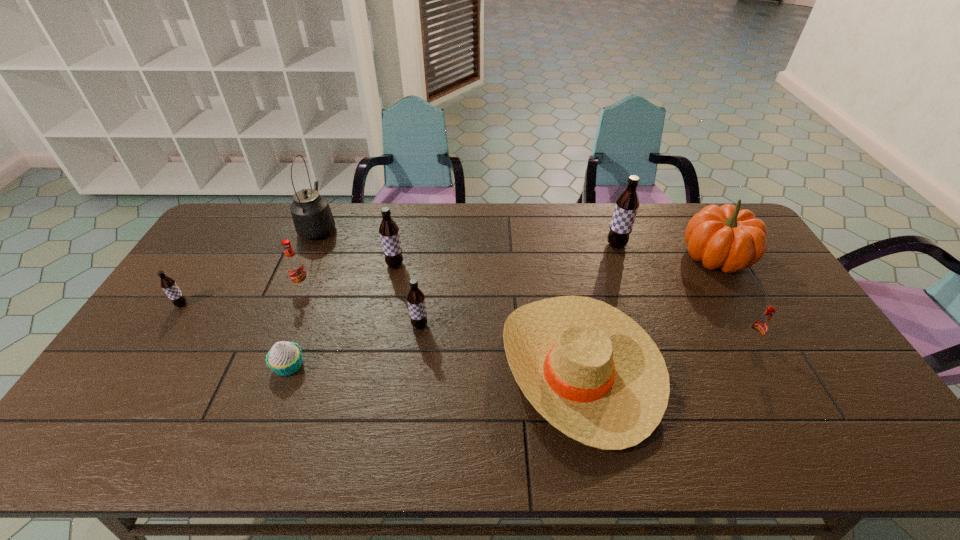
Image resolution: width=960 pixels, height=540 pixels. I want to click on kettle, so click(311, 213).

Identify the location of the farthest root beer. (626, 207).

Where is `the rightmost brown root beer`? the rightmost brown root beer is located at coordinates (626, 207).

The image size is (960, 540). I want to click on the second farthest root beer, so click(389, 231).

Identify the location of the second farthest brown root beer. (389, 231).

Find the location of `orange pumpkin`. orange pumpkin is located at coordinates (727, 237).

You are a GUI agent. You are given a task and a screenshot of the screen. Output one action in this format:
    pyautogui.click(x=<x>, y=<y>)
    Task: Click on the bigger red root beer
    The image size is (960, 540).
    Given the screenshot: What is the action you would take?
    pyautogui.click(x=294, y=265)

Identify the location of the farther red root beer. (294, 265).

In order to click on the third biggest brown root beer in this screenshot , I will do `click(416, 299)`.

What are the coordinates of `the fifth object from right to left` in the screenshot? It's located at (416, 299).